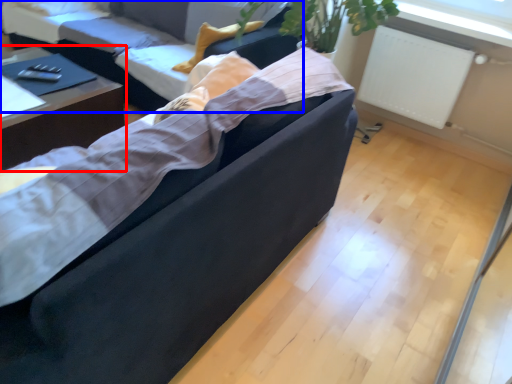
Question: Which of the following is the farthest to the observer, table (highlighted by a red box) or studio couch (highlighted by a blue box)?

Choices:
 (A) table
 (B) studio couch

Answer: (B)